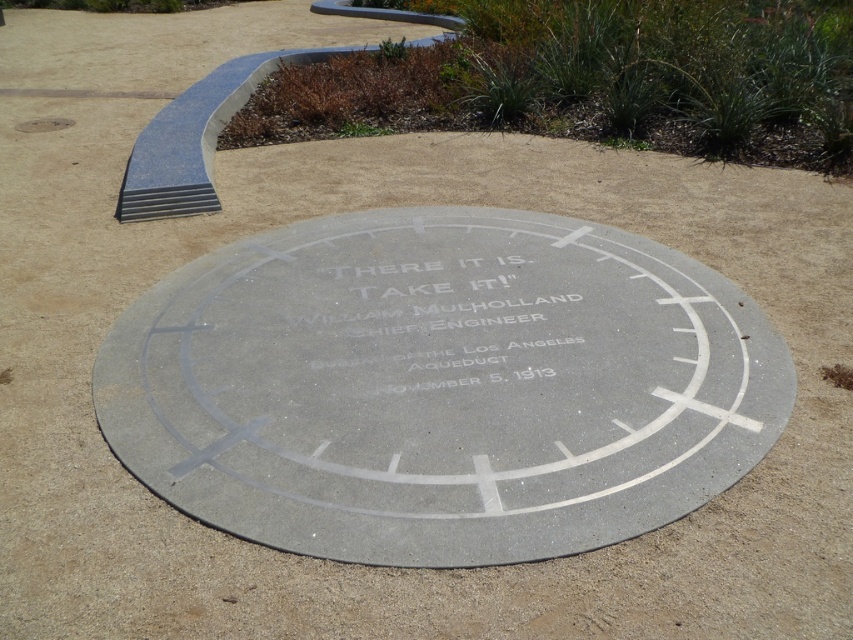
Question: Is gray concrete circle at center wider than gray concrete manhole cover at upper left?

Choices:
 (A) yes
 (B) no

Answer: (A)

Question: Can you confirm if gray concrete circle at center is positioned above gray concrete manhole cover at upper left?

Choices:
 (A) yes
 (B) no

Answer: (B)

Question: Which point appears closest to the camera in this image?

Choices:
 (A) (260, 499)
 (B) (15, 129)
 (C) (514, 348)

Answer: (A)

Question: Among these points, which one is farthest from the camera?

Choices:
 (A) (21, 122)
 (B) (358, 349)
 (C) (573, 288)

Answer: (A)

Question: Which of the following is the farthest from the observer?

Choices:
 (A) gray concrete circle at center
 (B) gray concrete manhole cover at upper left
 (C) white concrete engraving at center

Answer: (B)

Question: In this image, where is gray concrete circle at center located relative to white concrete engraving at center?

Choices:
 (A) left
 (B) right

Answer: (B)